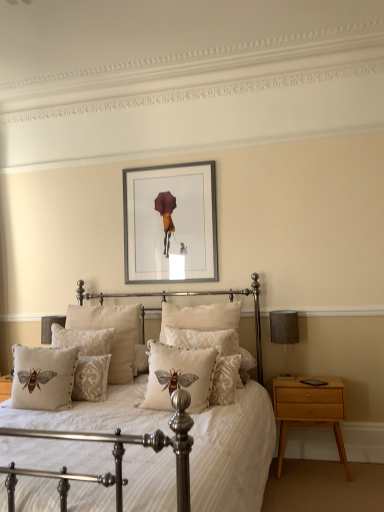
You are a GUI agent. You are given a task and a screenshot of the screen. Output one action in this format:
    pyautogui.click(x=<x>, y=<y>)
    Task: Click on the empty space that is ontop of textured gray lampshade at right (from a real-world perspective)
    This screenshot has height=512, width=384.
    Given the screenshot: What is the action you would take?
    pyautogui.click(x=280, y=312)